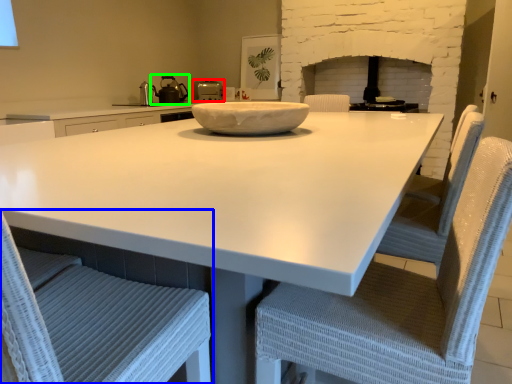
Question: Estimate the real-world distances between objects in this image. Which object is farther from kitchen appliance (highlighted by a red box), chair (highlighted by a blue box) or tea pot (highlighted by a green box)?

Choices:
 (A) chair
 (B) tea pot

Answer: (A)